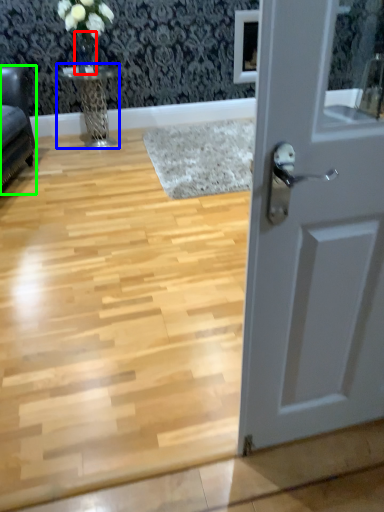
Question: Considering the real-world distances, which object is farthest from glass vase (highlighted by a red box)? table (highlighted by a blue box) or furniture (highlighted by a green box)?

Choices:
 (A) table
 (B) furniture

Answer: (B)